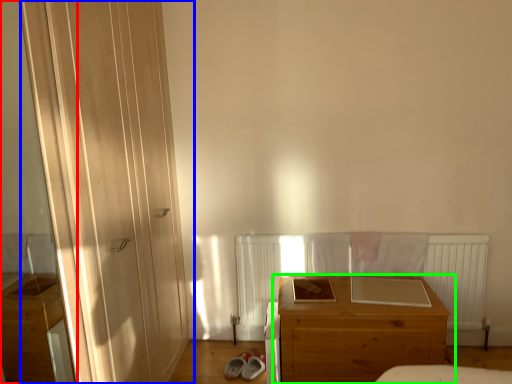
Question: Considering the real-world distances, which object is farthest from screen door (highlighted by a red box)? door (highlighted by a blue box) or chest of drawers (highlighted by a green box)?

Choices:
 (A) door
 (B) chest of drawers

Answer: (B)